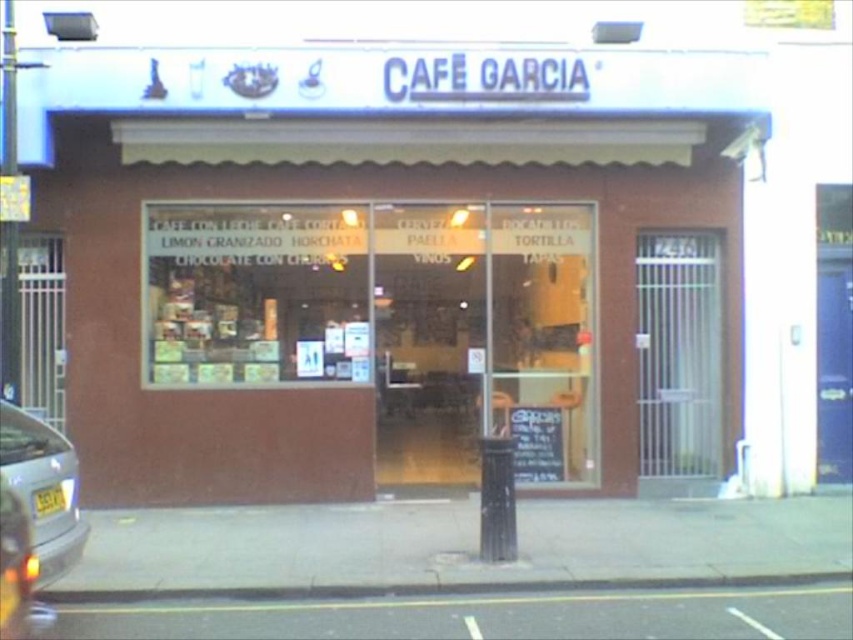
Question: Which point appears closest to the camera in this image?

Choices:
 (A) (640, 580)
 (B) (538, 454)

Answer: (A)

Question: Estimate the real-world distances between objects in this image. Which object is closer to the brown brick building at center?

Choices:
 (A) black chalkboard at center
 (B) silver metallic car at lower left
 (C) black asphalt curb at lower center

Answer: (A)

Question: Which point is closer to the camera taking this photo?

Choices:
 (A) (78, 554)
 (B) (535, 412)
 (C) (363, 592)

Answer: (A)

Question: Is the position of brown brick building at center more distant than that of silver metallic car at lower left?

Choices:
 (A) no
 (B) yes

Answer: (B)

Question: Is black asphalt curb at lower center thinner than black chalkboard at center?

Choices:
 (A) no
 (B) yes

Answer: (A)

Question: Is the position of brown brick building at center more distant than that of black chalkboard at center?

Choices:
 (A) yes
 (B) no

Answer: (B)